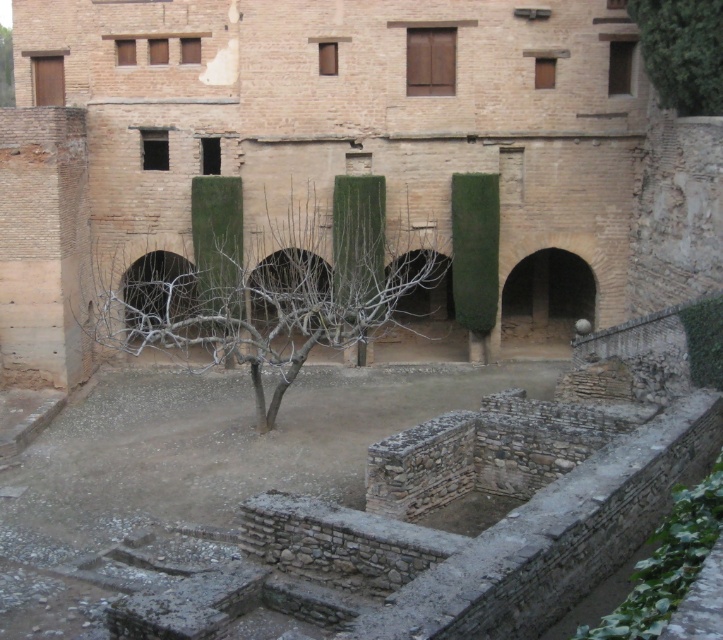
At what (x,y) coordinates should I click in order to perform the action: click on brown stone ruins at center. Please return your answer as a coordinate pair (x, y). This screenshot has height=640, width=723. Looking at the image, I should click on (350, 145).

Identify the location of brown stone ruins at center. (350, 145).

At what (x,y) coordinates should I click in order to perform the action: click on brown stone ruins at center. Please return your answer as a coordinate pair (x, y). Looking at the image, I should click on (350, 145).

Is point (4, 118) positioned behind point (1, 76)?

That is False.

Does brown stone ruins at center appear under green leafy tree at upper left?

Correct, brown stone ruins at center is located below green leafy tree at upper left.

Find the location of `brown stone ruins at center`. brown stone ruins at center is located at coordinates (350, 145).

In the scene shown: Who is positioned more to the right, bare branches at center or green leafy tree at upper left?

Positioned to the right is bare branches at center.

Who is more forward, (244, 355) or (4, 77)?

Point (244, 355) is more forward.

The width and height of the screenshot is (723, 640). What are the coordinates of `bare branches at center` in the screenshot? It's located at (265, 285).

Where is `bare branches at center`? bare branches at center is located at coordinates (265, 285).